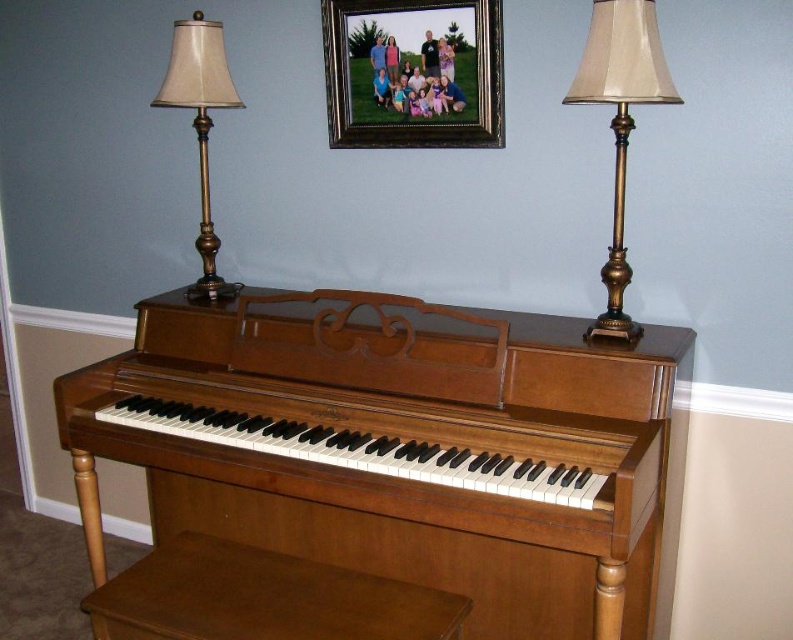
I want to click on wooden stool at lower center, so click(x=262, y=598).

Measure the distance between wooden stool at lower center and gold metallic table lamp at right.

wooden stool at lower center and gold metallic table lamp at right are 38.26 inches apart.

The image size is (793, 640). Identify the location of wooden stool at lower center. coord(262,598).

I want to click on wooden stool at lower center, so click(262, 598).

Is wooden picture frame at upper center positioned before gold metallic lampshade at left?

That is True.

Measure the distance between point (x=414, y=90) and camera.

Point (x=414, y=90) is 2.08 meters from camera.

Which is behind, point (359, 36) or point (217, 108)?

Point (217, 108)

The width and height of the screenshot is (793, 640). Identify the location of wooden picture frame at upper center. (412, 72).

Between wooden piano at center and wooden stool at lower center, which one is positioned lower?

Positioned lower is wooden stool at lower center.

Is wooden piano at center bigger than wooden stool at lower center?

Correct, wooden piano at center is larger in size than wooden stool at lower center.

Image resolution: width=793 pixels, height=640 pixels. I want to click on wooden piano at center, so click(x=382, y=468).